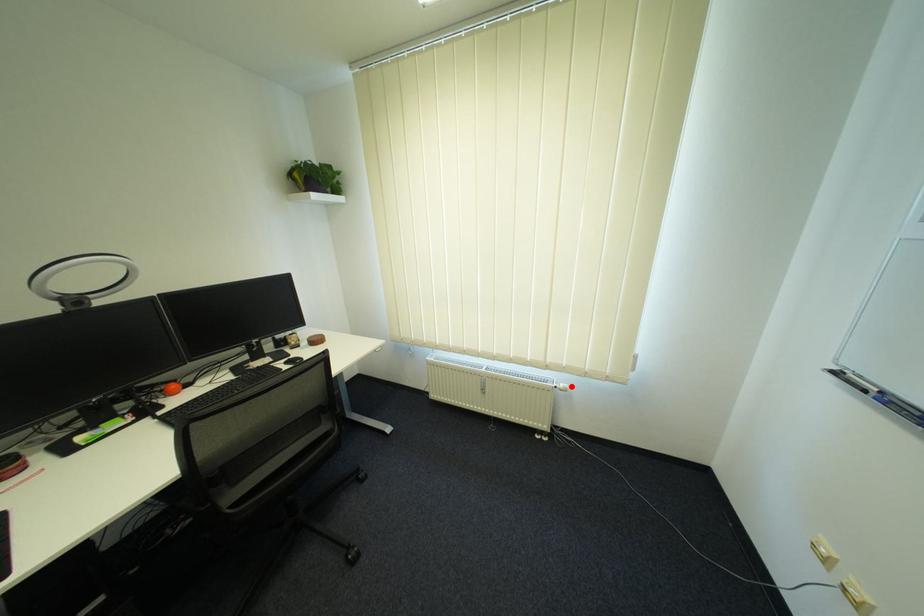
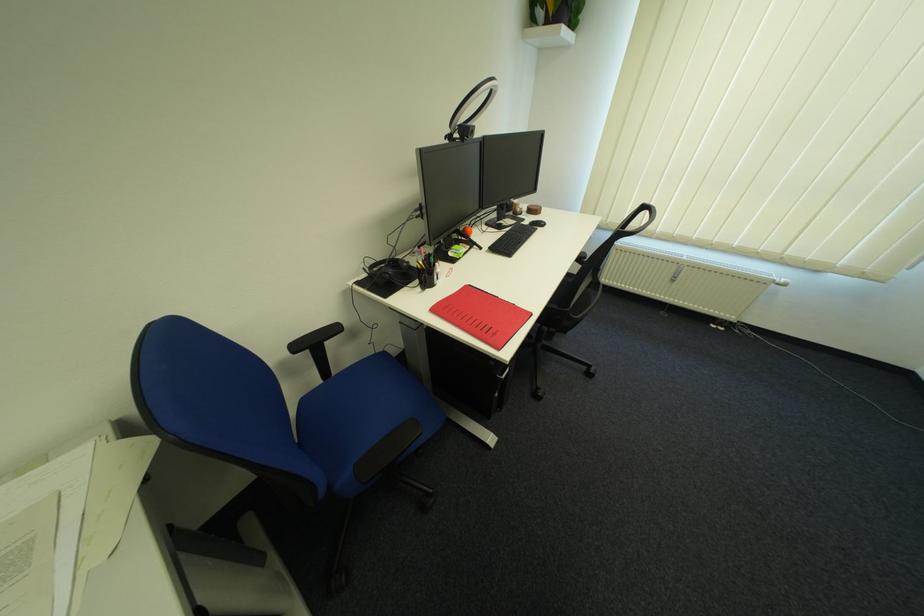
Question: I am providing you with two images of the same scene from different viewpoints. Image1 has a red point marked. In image2, the corresponding 3D location appears at what relative position? Reply with the corresponding letter.

Choices:
 (A) Closer
 (B) Farther

Answer: (A)